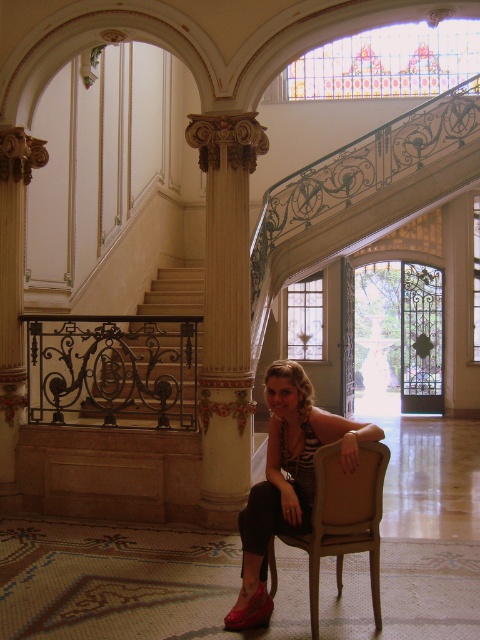
Looking at this image, is white marble column at center behind white marble column at left?

No.

Can you confirm if white marble column at center is bigger than white marble column at left?

Yes, white marble column at center is bigger than white marble column at left.

The width and height of the screenshot is (480, 640). What do you see at coordinates (226, 310) in the screenshot? I see `white marble column at center` at bounding box center [226, 310].

I want to click on white marble column at center, so click(226, 310).

Between white marble column at left and shiny red shoe at lower center, which one is positioned higher?

white marble column at left is above.

Does white marble column at left come behind shiny red shoe at lower center?

Yes, it is.

Is point (12, 160) in front of point (250, 620)?

No, (12, 160) is further to viewer.

Where is `white marble column at left`? The width and height of the screenshot is (480, 640). white marble column at left is located at coordinates (12, 275).

Is point (354, 436) positioned after point (20, 168)?

No, it is not.

Does matte black dress at center have a greater height compared to white marble column at left?

Incorrect, matte black dress at center's height is not larger of white marble column at left's.

Is point (337, 429) in front of point (17, 355)?

Yes, it is.

The image size is (480, 640). In order to click on matte black dress at center in this screenshot , I will do `click(287, 481)`.